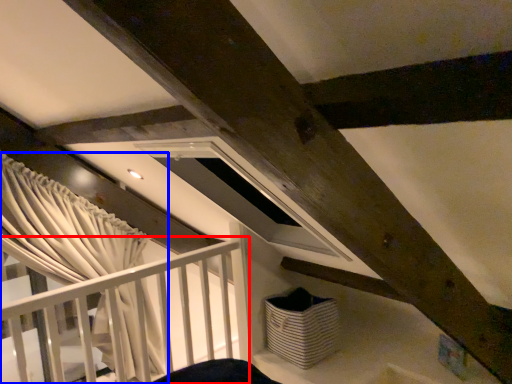
Question: Which object is closer to the camera taking this photo, rail (highlighted by a red box) or curtain (highlighted by a blue box)?

Choices:
 (A) rail
 (B) curtain

Answer: (A)